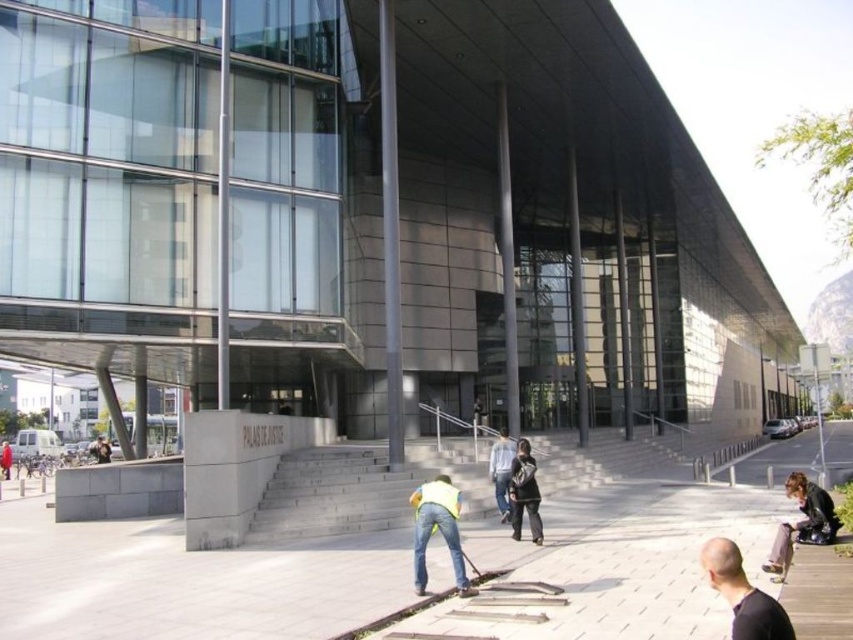
You are a security guard at the Palace of Justice and need to locate your equipment. You see a yellow reflective vest at lower center and a dark gray fabric jacket at center. Which item is located to the left of the other?

The yellow reflective vest at lower center is positioned on the left side of dark gray fabric jacket at center.

You are a security guard at the Palace of Justice. You need to put on your uniform before starting your shift. You see the yellow reflective vest at lower center and the leather jacket at lower right. Which item should you put on first if you want to wear the taller item first?

The yellow reflective vest at lower center is taller than the leather jacket at lower right, so you should put on the yellow reflective vest at lower center first.